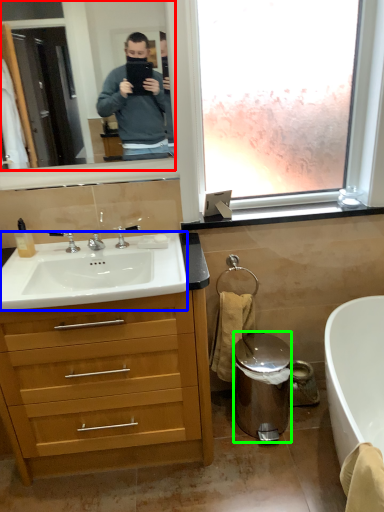
Question: Which is nearer to the mirror (highlighted by a red box)? sink (highlighted by a blue box) or trash bin/can (highlighted by a green box).

Choices:
 (A) sink
 (B) trash bin/can

Answer: (A)